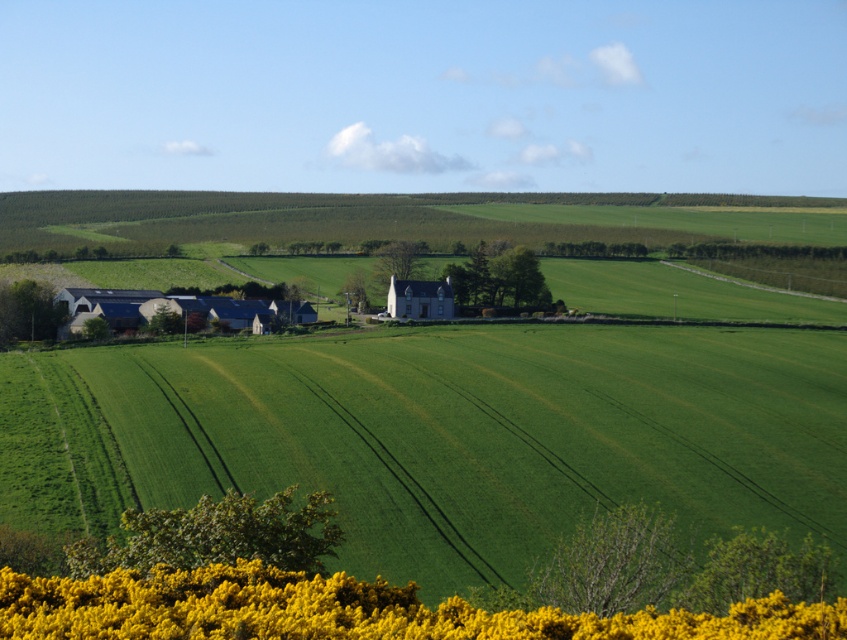
Question: Which object is farther from the camera taking this photo?

Choices:
 (A) green grassy field at center
 (B) yellow textured flowers at lower center

Answer: (A)

Question: Does green grassy field at center appear on the left side of yellow textured flowers at lower center?

Choices:
 (A) no
 (B) yes

Answer: (A)

Question: Which of the following is the farthest from the observer?

Choices:
 (A) green grassy field at center
 (B) yellow textured flowers at lower center

Answer: (A)

Question: Can you confirm if green grassy field at center is positioned to the right of yellow textured flowers at lower center?

Choices:
 (A) no
 (B) yes

Answer: (B)

Question: Does green grassy field at center appear on the left side of yellow textured flowers at lower center?

Choices:
 (A) yes
 (B) no

Answer: (B)